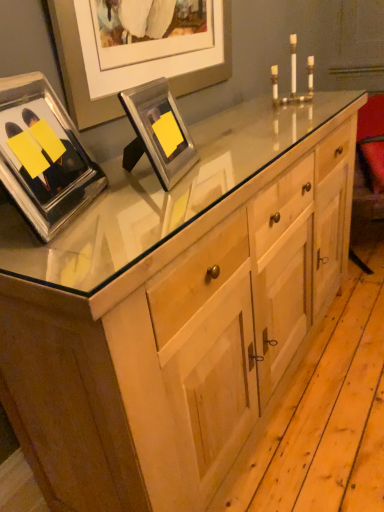
Question: Which direction should I rotate to look at metallic silver picture frame at upper center, arranged as the second picture frame when viewed from the left?

Choices:
 (A) right
 (B) left

Answer: (B)

Question: Is clear glass picture frame at upper left, which is the 1th picture frame from left to right, closer to camera compared to metallic silver picture frame at upper center, arranged as the second picture frame when viewed from the left?

Choices:
 (A) yes
 (B) no

Answer: (A)

Question: From the image's perspective, is clear glass picture frame at upper left, which is the 1th picture frame from left to right, beneath metallic silver picture frame at upper center, arranged as the 1th picture frame when viewed from the right?

Choices:
 (A) yes
 (B) no

Answer: (A)

Question: From a real-world perspective, is clear glass picture frame at upper left, which is the 1th picture frame from left to right, physically above metallic silver picture frame at upper center, arranged as the 1th picture frame when viewed from the right?

Choices:
 (A) yes
 (B) no

Answer: (A)

Question: Considering the relative positions of clear glass picture frame at upper left, which is the second picture frame in right-to-left order, and metallic silver picture frame at upper center, arranged as the second picture frame when viewed from the left, in the image provided, is clear glass picture frame at upper left, which is the second picture frame in right-to-left order, to the right of metallic silver picture frame at upper center, arranged as the second picture frame when viewed from the left, from the viewer's perspective?

Choices:
 (A) no
 (B) yes

Answer: (A)

Question: Does clear glass picture frame at upper left, which is the 1th picture frame from left to right, have a lesser width compared to metallic silver picture frame at upper center, arranged as the 1th picture frame when viewed from the right?

Choices:
 (A) no
 (B) yes

Answer: (A)

Question: Does clear glass picture frame at upper left, which is the second picture frame in right-to-left order, have a smaller size compared to metallic silver picture frame at upper center, arranged as the second picture frame when viewed from the left?

Choices:
 (A) yes
 (B) no

Answer: (B)

Question: From a real-world perspective, is gold metallic candle holder at upper center beneath metallic silver picture frame at upper center, arranged as the 1th picture frame when viewed from the right?

Choices:
 (A) yes
 (B) no

Answer: (B)

Question: Are gold metallic candle holder at upper center and metallic silver picture frame at upper center, arranged as the second picture frame when viewed from the left, far apart?

Choices:
 (A) no
 (B) yes

Answer: (A)

Question: Can you confirm if gold metallic candle holder at upper center is thinner than metallic silver picture frame at upper center, arranged as the 1th picture frame when viewed from the right?

Choices:
 (A) no
 (B) yes

Answer: (A)

Question: Is gold metallic candle holder at upper center to the left of metallic silver picture frame at upper center, arranged as the 1th picture frame when viewed from the right, from the viewer's perspective?

Choices:
 (A) yes
 (B) no

Answer: (B)

Question: Is gold metallic candle holder at upper center closer to the viewer compared to metallic silver picture frame at upper center, arranged as the second picture frame when viewed from the left?

Choices:
 (A) yes
 (B) no

Answer: (B)

Question: Is gold metallic candle holder at upper center oriented towards metallic silver picture frame at upper center, arranged as the 1th picture frame when viewed from the right?

Choices:
 (A) yes
 (B) no

Answer: (B)

Question: Does metallic silver picture frame at upper center, arranged as the 1th picture frame when viewed from the right, have a greater height compared to clear glass picture frame at upper left, which is the 1th picture frame from left to right?

Choices:
 (A) yes
 (B) no

Answer: (B)